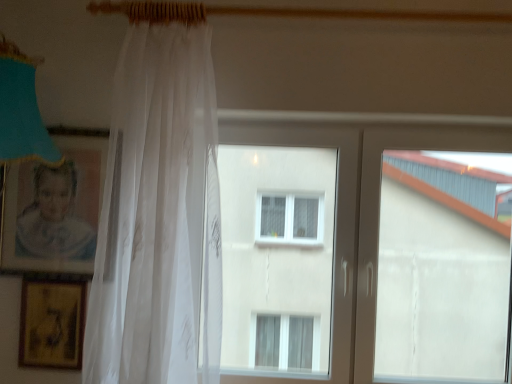
What is the approximate width of white plastic window at center?

The width of white plastic window at center is 4.40 inches.

Measure the distance between point (128, 196) and camera.

They are 4.41 feet apart.

In order to click on white plastic window at center in this screenshot , I will do `click(356, 218)`.

Does matte cardboard picture frame at left, the 2th picture frame in the bottom-to-top sequence, have a larger size compared to gold textured picture frame at lower left, which is counted as the 1th picture frame, starting from the bottom?

Correct, matte cardboard picture frame at left, the 2th picture frame in the bottom-to-top sequence, is larger in size than gold textured picture frame at lower left, which is counted as the 1th picture frame, starting from the bottom.

Is matte cardboard picture frame at left, placed as the 1th picture frame when sorted from top to bottom, not close to gold textured picture frame at lower left, which is counted as the 1th picture frame, starting from the bottom?

They are positioned close to each other.

Based on the photo, is gold textured picture frame at lower left, the second picture frame from the top, completely or partially inside matte cardboard picture frame at left, the 2th picture frame in the bottom-to-top sequence?

No, gold textured picture frame at lower left, the second picture frame from the top, is not surrounded by matte cardboard picture frame at left, the 2th picture frame in the bottom-to-top sequence.

Which of these two, matte cardboard picture frame at left, placed as the 1th picture frame when sorted from top to bottom, or gold textured picture frame at lower left, which is counted as the 1th picture frame, starting from the bottom, stands taller?

matte cardboard picture frame at left, placed as the 1th picture frame when sorted from top to bottom, is taller.

Considering the relative sizes of translucent white curtain at left and gold textured picture frame at lower left, the second picture frame from the top, in the image provided, is translucent white curtain at left thinner than gold textured picture frame at lower left, the second picture frame from the top,?

No.

Would you consider translucent white curtain at left to be distant from gold textured picture frame at lower left, the second picture frame from the top?

No.

Between point (124, 52) and point (36, 331), which one is positioned in front?

The point (124, 52) is closer to the camera.

Would you say translucent white curtain at left is inside or outside gold textured picture frame at lower left, the second picture frame from the top?

translucent white curtain at left cannot be found inside gold textured picture frame at lower left, the second picture frame from the top.

You are a GUI agent. You are given a task and a screenshot of the screen. Output one action in this format:
    pyautogui.click(x=<x>, y=<y>)
    Task: Click on the picture frame below the white plastic window at center (from the image's perspective)
    This screenshot has height=384, width=512.
    Given the screenshot: What is the action you would take?
    pyautogui.click(x=52, y=323)

Is white plastic window at center facing away from gold textured picture frame at lower left, the second picture frame from the top?

No, gold textured picture frame at lower left, the second picture frame from the top, is not at the back of white plastic window at center.

Based on the photo, how much distance is there between white plastic window at center and gold textured picture frame at lower left, the second picture frame from the top?

They are 99.46 centimeters apart.

From the picture: Considering the relative sizes of white plastic window at center and gold textured picture frame at lower left, the second picture frame from the top, in the image provided, is white plastic window at center shorter than gold textured picture frame at lower left, the second picture frame from the top,?

No, white plastic window at center is not shorter than gold textured picture frame at lower left, the second picture frame from the top.

From a real-world perspective, which picture frame is the 1st one underneath the translucent white curtain at left? Please provide its 2D coordinates.

[(54, 210)]

Considering the positions of point (154, 230) and point (42, 240), is point (154, 230) closer or farther from the camera than point (42, 240)?

Point (154, 230).

Who is smaller, translucent white curtain at left or matte cardboard picture frame at left, placed as the 1th picture frame when sorted from top to bottom?

With smaller size is matte cardboard picture frame at left, placed as the 1th picture frame when sorted from top to bottom.

In the scene shown: Considering the relative sizes of gold textured picture frame at lower left, the second picture frame from the top, and matte cardboard picture frame at left, placed as the 1th picture frame when sorted from top to bottom, in the image provided, is gold textured picture frame at lower left, the second picture frame from the top, smaller than matte cardboard picture frame at left, placed as the 1th picture frame when sorted from top to bottom,?

Yes, gold textured picture frame at lower left, the second picture frame from the top, is smaller than matte cardboard picture frame at left, placed as the 1th picture frame when sorted from top to bottom.

Is gold textured picture frame at lower left, which is counted as the 1th picture frame, starting from the bottom, completely or partially outside of matte cardboard picture frame at left, placed as the 1th picture frame when sorted from top to bottom?

Absolutely, gold textured picture frame at lower left, which is counted as the 1th picture frame, starting from the bottom, is external to matte cardboard picture frame at left, placed as the 1th picture frame when sorted from top to bottom.

Looking at this image, in terms of height, does gold textured picture frame at lower left, the second picture frame from the top, look taller or shorter compared to matte cardboard picture frame at left, the 2th picture frame in the bottom-to-top sequence?

In the image, gold textured picture frame at lower left, the second picture frame from the top, appears to be shorter than matte cardboard picture frame at left, the 2th picture frame in the bottom-to-top sequence.

From the image's perspective, does gold textured picture frame at lower left, the second picture frame from the top, appear higher than matte cardboard picture frame at left, placed as the 1th picture frame when sorted from top to bottom?

No.

In the image, is matte cardboard picture frame at left, the 2th picture frame in the bottom-to-top sequence, positioned in front of or behind translucent white curtain at left?

matte cardboard picture frame at left, the 2th picture frame in the bottom-to-top sequence, is positioned farther from the viewer than translucent white curtain at left.

This screenshot has height=384, width=512. What are the coordinates of `curtain to the right of matte cardboard picture frame at left, the 2th picture frame in the bottom-to-top sequence` in the screenshot? It's located at (158, 206).

Could you tell me if matte cardboard picture frame at left, placed as the 1th picture frame when sorted from top to bottom, is facing translucent white curtain at left?

No, matte cardboard picture frame at left, placed as the 1th picture frame when sorted from top to bottom, is not oriented towards translucent white curtain at left.

Is matte cardboard picture frame at left, the 2th picture frame in the bottom-to-top sequence, spatially inside translucent white curtain at left, or outside of it?

matte cardboard picture frame at left, the 2th picture frame in the bottom-to-top sequence, cannot be found inside translucent white curtain at left.

From a real-world perspective, is gold textured picture frame at lower left, the second picture frame from the top, located higher than white plastic window at center?

No, from a real-world perspective, gold textured picture frame at lower left, the second picture frame from the top, is not on top of white plastic window at center.

Is gold textured picture frame at lower left, which is counted as the 1th picture frame, starting from the bottom, wider or thinner than white plastic window at center?

Clearly, gold textured picture frame at lower left, which is counted as the 1th picture frame, starting from the bottom, has less width compared to white plastic window at center.

Could white plastic window at center be considered to be inside gold textured picture frame at lower left, which is counted as the 1th picture frame, starting from the bottom?

Actually, white plastic window at center is outside gold textured picture frame at lower left, which is counted as the 1th picture frame, starting from the bottom.

Considering the sizes of objects gold textured picture frame at lower left, which is counted as the 1th picture frame, starting from the bottom, and white plastic window at center in the image provided, who is bigger, gold textured picture frame at lower left, which is counted as the 1th picture frame, starting from the bottom, or white plastic window at center?

white plastic window at center.

Locate an element on the screen. picture frame below the matte cardboard picture frame at left, placed as the 1th picture frame when sorted from top to bottom (from the image's perspective) is located at coordinates (52, 323).

This screenshot has height=384, width=512. I want to click on curtain located in front of the gold textured picture frame at lower left, the second picture frame from the top, so click(x=158, y=206).

Considering their positions, is gold textured picture frame at lower left, which is counted as the 1th picture frame, starting from the bottom, positioned further to translucent white curtain at left than matte cardboard picture frame at left, placed as the 1th picture frame when sorted from top to bottom?

The object further to translucent white curtain at left is gold textured picture frame at lower left, which is counted as the 1th picture frame, starting from the bottom.

Estimate the real-world distances between objects in this image. Which object is closer to translucent white curtain at left, gold textured picture frame at lower left, which is counted as the 1th picture frame, starting from the bottom, or white plastic window at center?

Among the two, gold textured picture frame at lower left, which is counted as the 1th picture frame, starting from the bottom, is located nearer to translucent white curtain at left.

Considering their positions, is translucent white curtain at left positioned further to gold textured picture frame at lower left, which is counted as the 1th picture frame, starting from the bottom, than white plastic window at center?

white plastic window at center is further to gold textured picture frame at lower left, which is counted as the 1th picture frame, starting from the bottom.

From the image, which object appears to be farther from translucent white curtain at left, matte cardboard picture frame at left, the 2th picture frame in the bottom-to-top sequence, or white plastic window at center?

white plastic window at center lies further to translucent white curtain at left than the other object.

Estimate the real-world distances between objects in this image. Which object is further from matte cardboard picture frame at left, the 2th picture frame in the bottom-to-top sequence, white plastic window at center or translucent white curtain at left?

The object further to matte cardboard picture frame at left, the 2th picture frame in the bottom-to-top sequence, is white plastic window at center.

When comparing their distances from white plastic window at center, does matte cardboard picture frame at left, placed as the 1th picture frame when sorted from top to bottom, or translucent white curtain at left seem further?

matte cardboard picture frame at left, placed as the 1th picture frame when sorted from top to bottom, is further to white plastic window at center.

Which object lies further to the anchor point gold textured picture frame at lower left, which is counted as the 1th picture frame, starting from the bottom, white plastic window at center or matte cardboard picture frame at left, placed as the 1th picture frame when sorted from top to bottom?

white plastic window at center lies further to gold textured picture frame at lower left, which is counted as the 1th picture frame, starting from the bottom, than the other object.

Estimate the real-world distances between objects in this image. Which object is further from gold textured picture frame at lower left, the second picture frame from the top, matte cardboard picture frame at left, placed as the 1th picture frame when sorted from top to bottom, or translucent white curtain at left?

The object further to gold textured picture frame at lower left, the second picture frame from the top, is translucent white curtain at left.

This screenshot has width=512, height=384. I want to click on picture frame between matte cardboard picture frame at left, placed as the 1th picture frame when sorted from top to bottom, and white plastic window at center, in the horizontal direction, so click(x=52, y=323).

Find the location of a particular element. The image size is (512, 384). curtain between matte cardboard picture frame at left, placed as the 1th picture frame when sorted from top to bottom, and white plastic window at center, in the horizontal direction is located at coordinates (158, 206).

Where is `curtain between matte cardboard picture frame at left, placed as the 1th picture frame when sorted from top to bottom, and gold textured picture frame at lower left, which is counted as the 1th picture frame, starting from the bottom, from top to bottom`? curtain between matte cardboard picture frame at left, placed as the 1th picture frame when sorted from top to bottom, and gold textured picture frame at lower left, which is counted as the 1th picture frame, starting from the bottom, from top to bottom is located at coordinates [158, 206].

This screenshot has height=384, width=512. In order to click on curtain between gold textured picture frame at lower left, the second picture frame from the top, and white plastic window at center from left to right in this screenshot , I will do `click(158, 206)`.